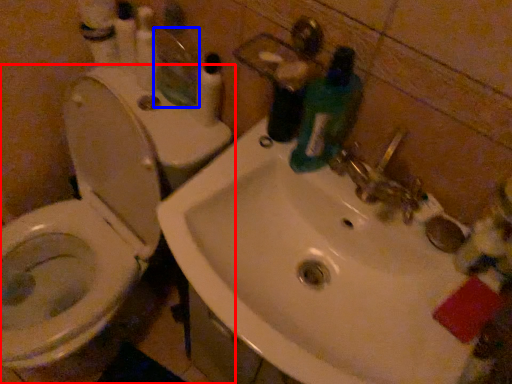
Question: Which object appears farthest to the camera in this image, toilet (highlighted by a red box) or mirror (highlighted by a blue box)?

Choices:
 (A) toilet
 (B) mirror

Answer: (B)